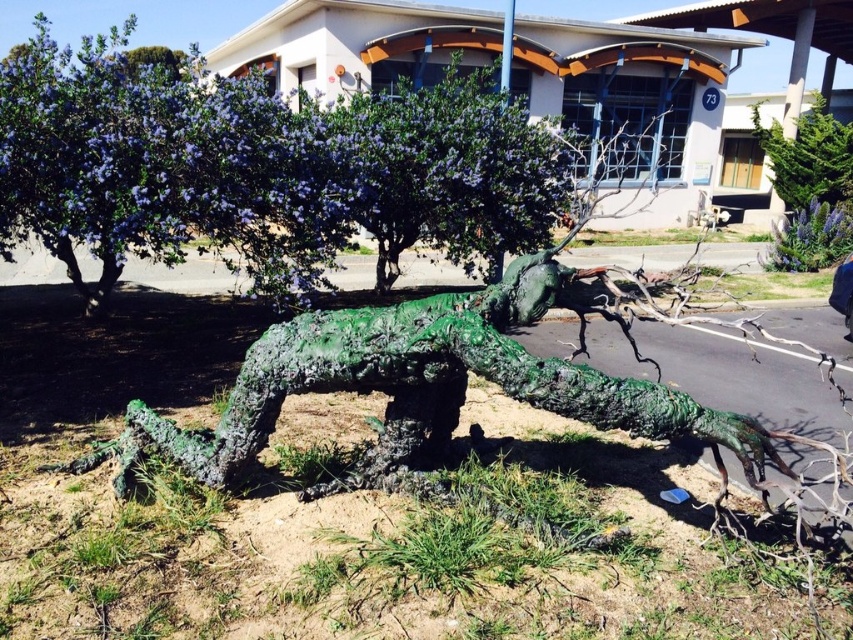
Does green matte tree at upper center have a greater height compared to green textured sculpture at center?

Incorrect, green matte tree at upper center's height is not larger of green textured sculpture at center's.

Identify the location of green matte tree at upper center. (257, 168).

Find the location of `green matte tree at upper center`. green matte tree at upper center is located at coordinates (257, 168).

Between green textured sculpture at center and green textured tree at upper right, which one is positioned higher?

green textured tree at upper right is above.

In the scene shown: Who is lower down, green textured sculpture at center or green textured tree at upper right?

green textured sculpture at center is below.

The width and height of the screenshot is (853, 640). What do you see at coordinates (427, 385) in the screenshot?
I see `green textured sculpture at center` at bounding box center [427, 385].

You are a GUI agent. You are given a task and a screenshot of the screen. Output one action in this format:
    pyautogui.click(x=<x>, y=<y>)
    Task: Click on the green textured sculpture at center
    This screenshot has height=640, width=853.
    Given the screenshot: What is the action you would take?
    pyautogui.click(x=427, y=385)

Which of these two, green matte tree at upper center or green textured tree at upper right, stands shorter?

Standing shorter between the two is green matte tree at upper center.

Is point (138, 253) less distant than point (804, 144)?

Yes, point (138, 253) is in front of point (804, 144).

Identify the location of green matte tree at upper center. The image size is (853, 640). 257,168.